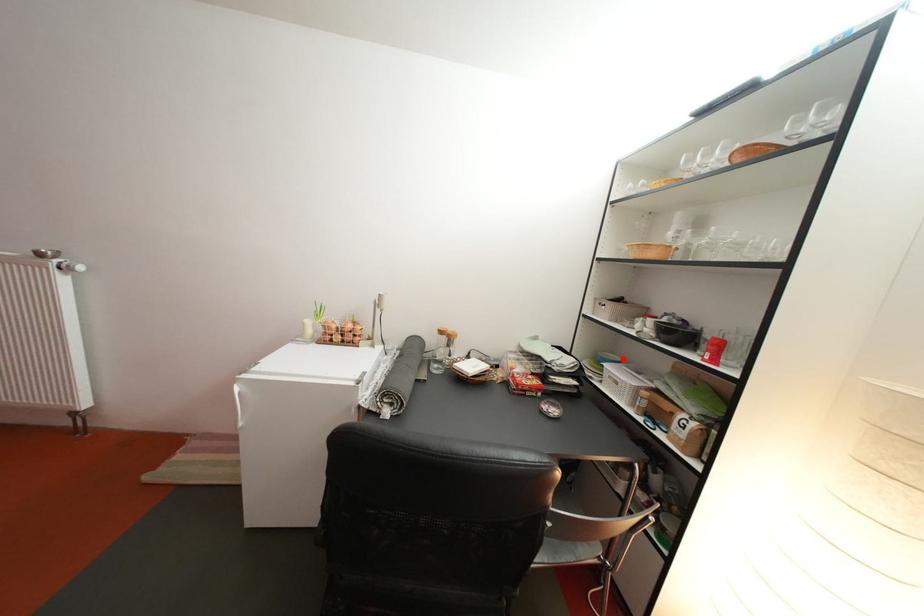
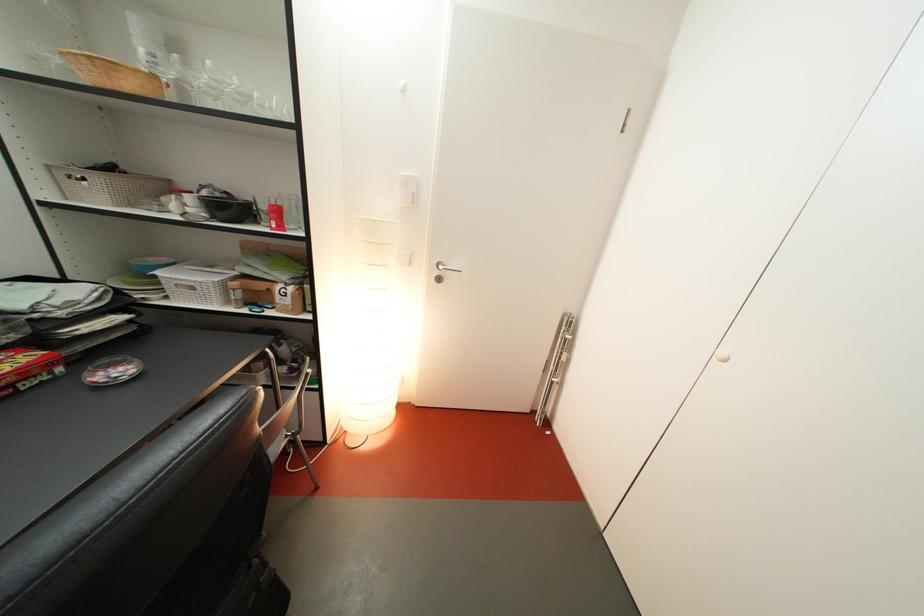
Question: A red point is marked in image1. In image2, is the corresponding 3D point closer to the camera or farther? Reply with the corresponding letter.

Choices:
 (A) The corresponding 3D point is closer.
 (B) The corresponding 3D point is farther.

Answer: (A)